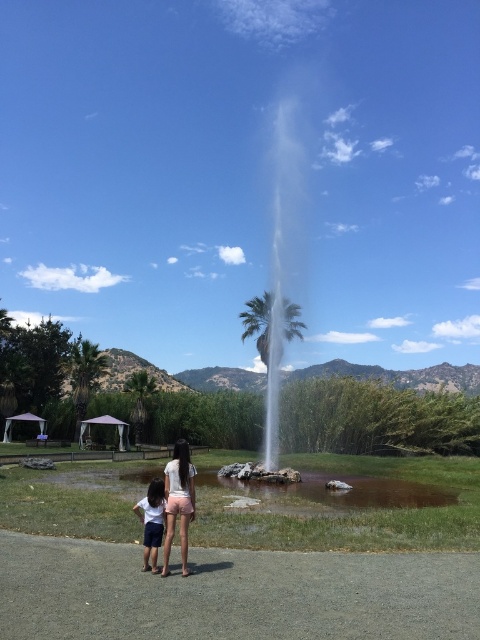
Can you confirm if white frothy water at center is shorter than light blue denim shorts at lower left?

In fact, white frothy water at center may be taller than light blue denim shorts at lower left.

Is point (282, 339) closer to camera compared to point (153, 477)?

No, it is not.

Who is more forward, (x=288, y=308) or (x=156, y=547)?

Point (x=156, y=547) is in front.

Where is `white frothy water at center`? The height and width of the screenshot is (640, 480). white frothy water at center is located at coordinates (279, 272).

Is point (184, 472) positioned behind point (159, 536)?

Yes.

Locate an element on the screen. The image size is (480, 640). pink fabric shorts at center is located at coordinates (179, 500).

Find the location of a particular element. This screenshot has height=640, width=480. pink fabric shorts at center is located at coordinates (179, 500).

Does point (262, 328) lie in front of point (167, 484)?

No, (262, 328) is further to viewer.

Is white frothy water at center in front of pink fabric shorts at center?

No.

Image resolution: width=480 pixels, height=640 pixels. Identify the location of white frothy water at center. (279, 272).

Find the location of a particular element. white frothy water at center is located at coordinates (279, 272).